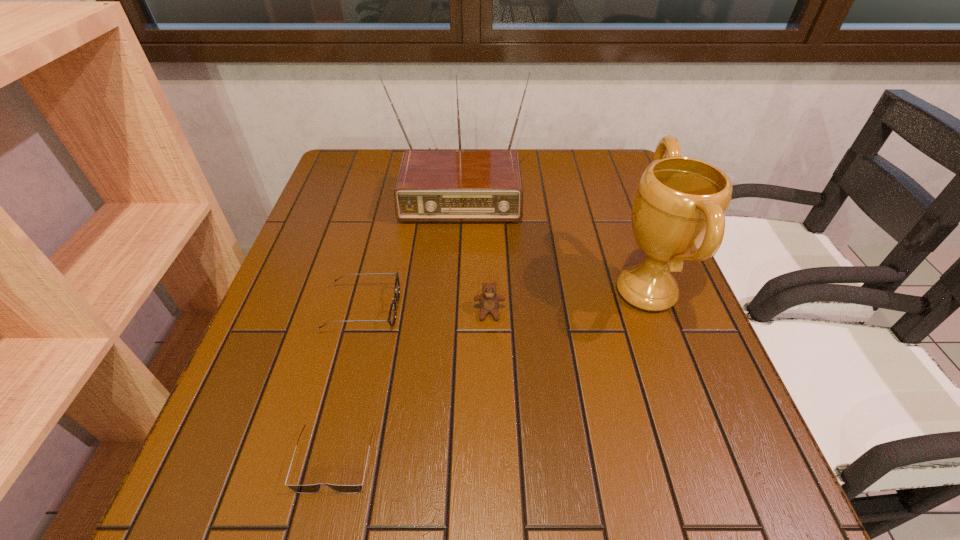
Identify the location of vacant space at the right edge. The height and width of the screenshot is (540, 960). point(670,380).

I want to click on blank area at the far left corner, so click(x=368, y=153).

Locate an element on the screen. Image resolution: width=960 pixels, height=540 pixels. free area in between the radio_receiver and the third shortest object is located at coordinates (473, 248).

Locate an element on the screen. Image resolution: width=960 pixels, height=540 pixels. vacant area between the rightmost object and the shortest object is located at coordinates (491, 375).

This screenshot has height=540, width=960. Identify the location of vacant space that's between the third tallest object and the rightmost object. (567, 302).

The image size is (960, 540). Identify the location of vacant area between the third tallest object and the radio_receiver. (473, 248).

Where is `free space between the award and the third tallest object`? This screenshot has height=540, width=960. free space between the award and the third tallest object is located at coordinates (567, 302).

This screenshot has height=540, width=960. What are the coordinates of `unoccupied area between the shortest object and the radio_receiver` in the screenshot? It's located at (397, 321).

Where is `vacant space that is in between the second shortest object and the shortest object`? The height and width of the screenshot is (540, 960). vacant space that is in between the second shortest object and the shortest object is located at coordinates (349, 384).

Identify the location of free space between the third shortest object and the farthest object. The image size is (960, 540). (473, 248).